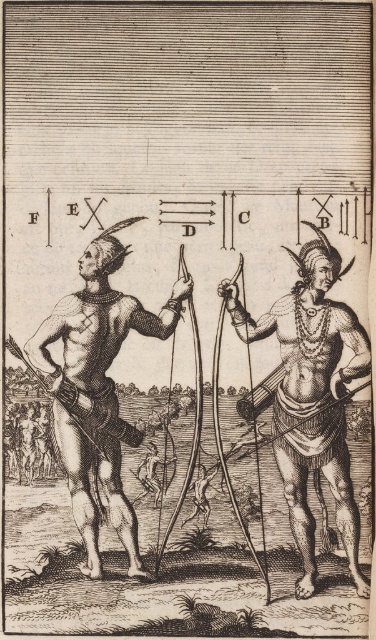
Based on the engraving, how does the size of the smooth wood bow at center compare to the black textured skin at left?

The smooth wood bow at center has a smaller size compared to the black textured skin at left.

Based on the engraving, what is the object located at the coordinates point (312, 396)?

The object at point (312, 396) is a smooth wood bow at center.

You are an archer who needs to choose a weapon. You see a smooth wood bow at center and a black textured skin at left. Which one is narrower?

The smooth wood bow at center is narrower than the black textured skin at left.